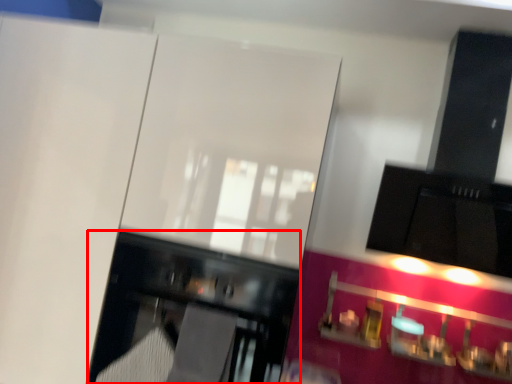
Question: From the image's perspective, considering the relative positions of furniture (annotated by the red box) and cabinetry in the image provided, where is furniture (annotated by the red box) located with respect to the staircase?

Choices:
 (A) below
 (B) above

Answer: (B)